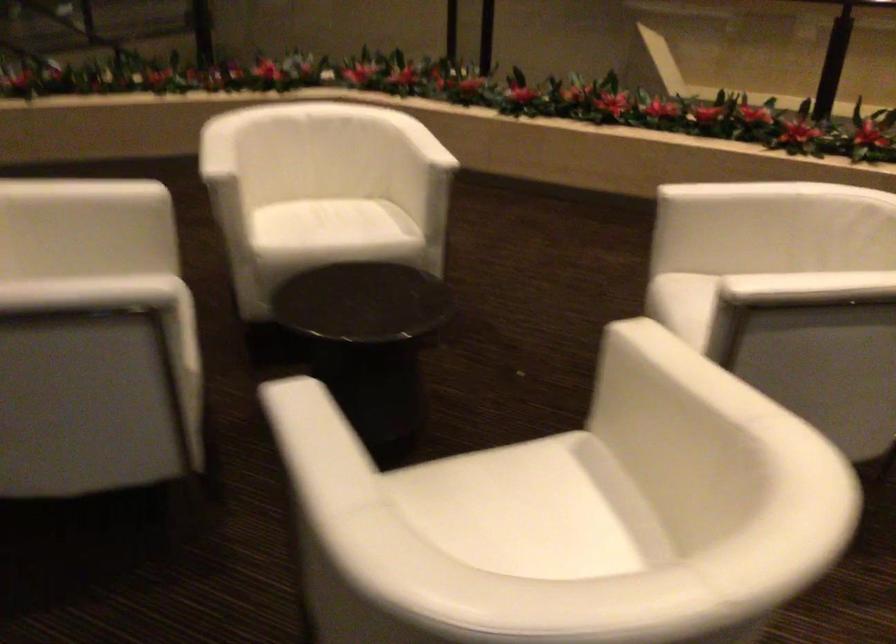
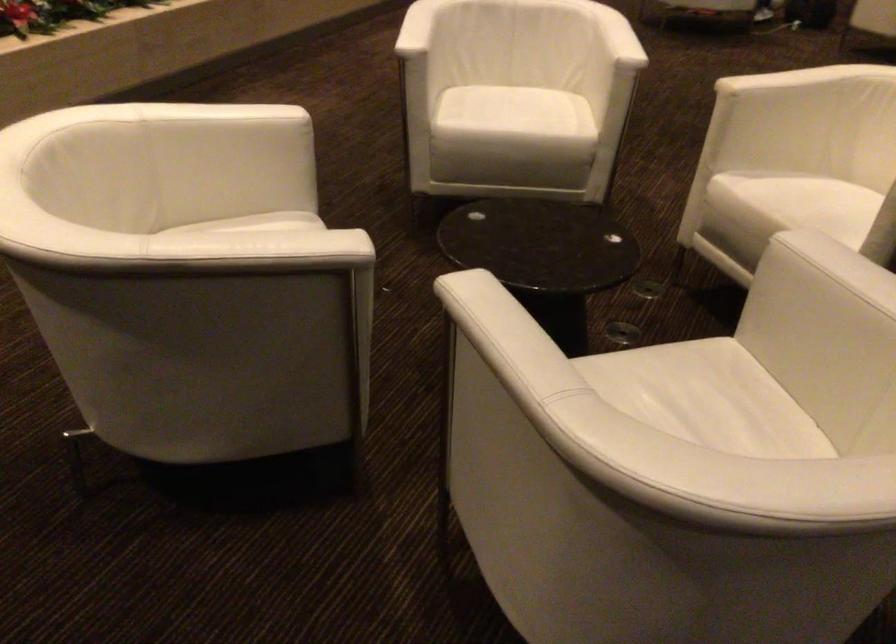
In the second image, find the point that corresponds to point 793,275 in the first image.

(617, 37)